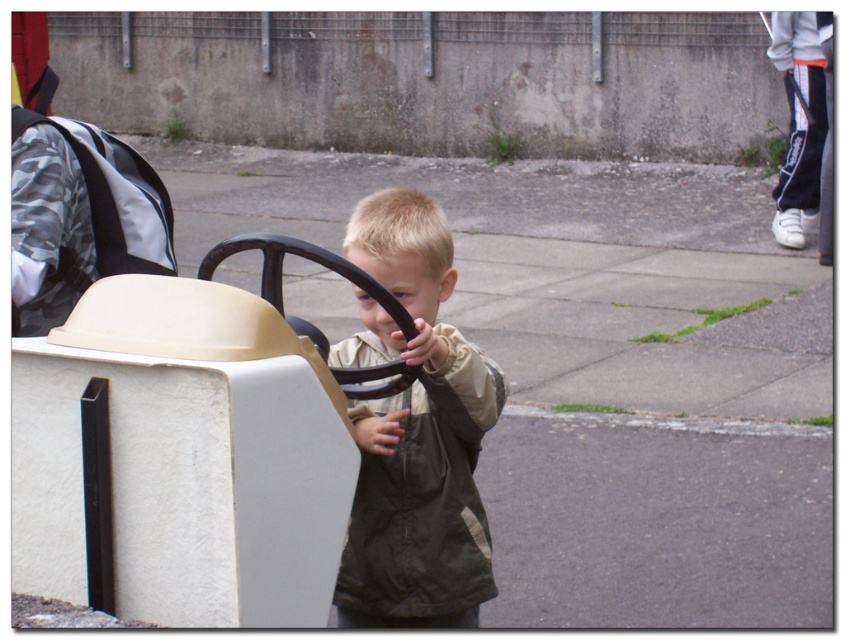
Question: Among these objects, which one is nearest to the camera?

Choices:
 (A) khaki fabric jacket at center
 (B) beige plastic steering wheel at center

Answer: (B)

Question: Does khaki fabric jacket at center have a smaller size compared to beige plastic steering wheel at center?

Choices:
 (A) no
 (B) yes

Answer: (A)

Question: Can you confirm if khaki fabric jacket at center is wider than beige plastic steering wheel at center?

Choices:
 (A) yes
 (B) no

Answer: (B)

Question: Which point appears closest to the camera in this image?

Choices:
 (A) click(412, 342)
 (B) click(292, 317)

Answer: (B)

Question: Can you confirm if khaki fabric jacket at center is thinner than beige plastic steering wheel at center?

Choices:
 (A) no
 (B) yes

Answer: (B)